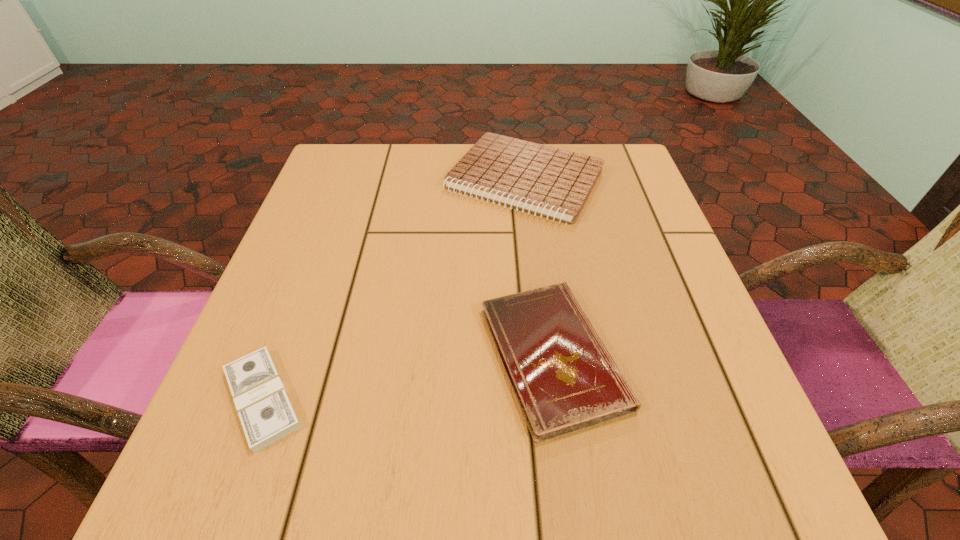
What are the coordinates of `notebook at the near edge` in the screenshot? It's located at (564, 378).

The width and height of the screenshot is (960, 540). I want to click on dollar located in the near edge section of the desktop, so click(265, 411).

The image size is (960, 540). Find the location of `object positioned at the left edge`. object positioned at the left edge is located at coordinates (265, 411).

I want to click on object that is positioned at the near left corner, so click(265, 411).

Locate an element on the screen. object located in the far right corner section of the desktop is located at coordinates tap(553, 182).

At what (x,y) coordinates should I click in order to perform the action: click on object located at the near right corner. Please return your answer as a coordinate pair (x, y). This screenshot has width=960, height=540. Looking at the image, I should click on (564, 378).

This screenshot has height=540, width=960. In the image, there is a desktop. What are the coordinates of `vacant region at the near edge` in the screenshot? It's located at (319, 489).

In the image, there is a desktop. Identify the location of vacant space at the left edge. (204, 440).

Image resolution: width=960 pixels, height=540 pixels. Find the location of `free location at the right edge`. free location at the right edge is located at coordinates (664, 268).

This screenshot has height=540, width=960. In the image, there is a desktop. Find the location of `vacant space at the far left corner`. vacant space at the far left corner is located at coordinates (384, 180).